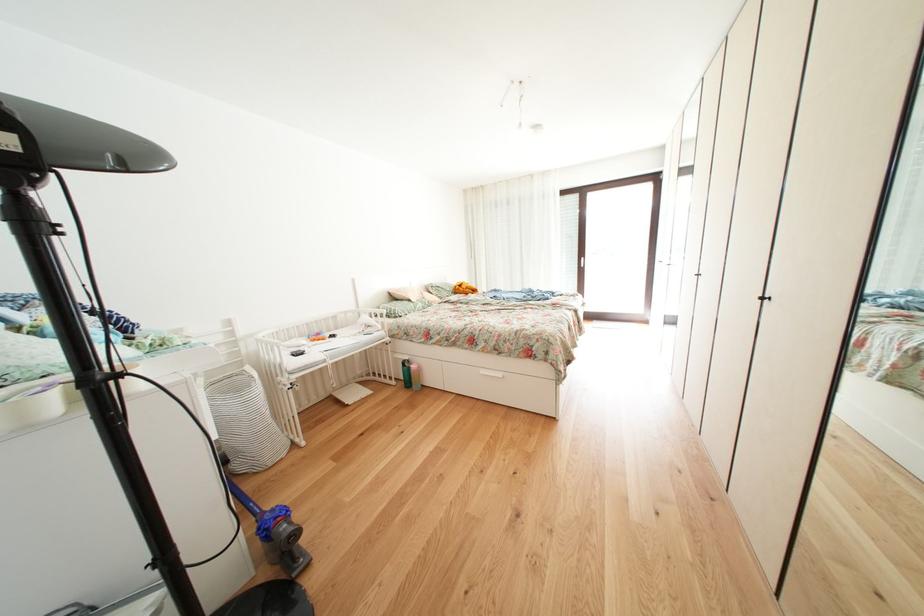
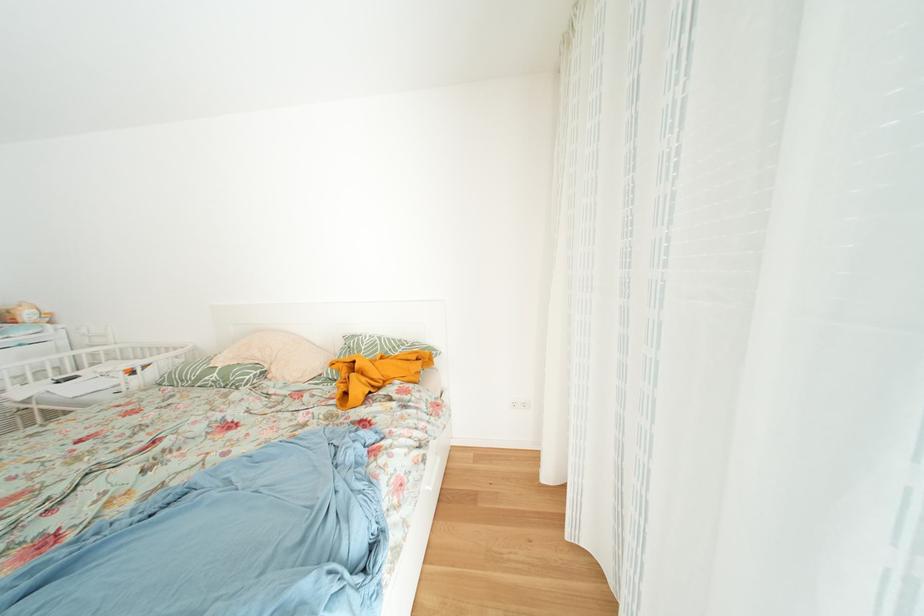
Where in the second image is the point corresponding to [424,313] from the first image?

(208, 384)